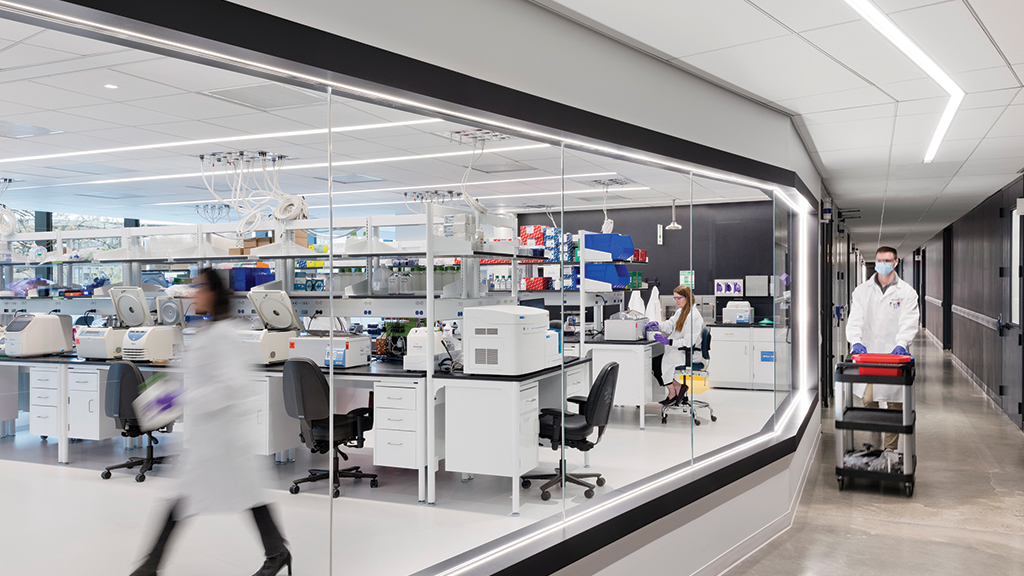
The height and width of the screenshot is (576, 1024). Identify the location of white desks. click(x=511, y=416), click(x=396, y=420).